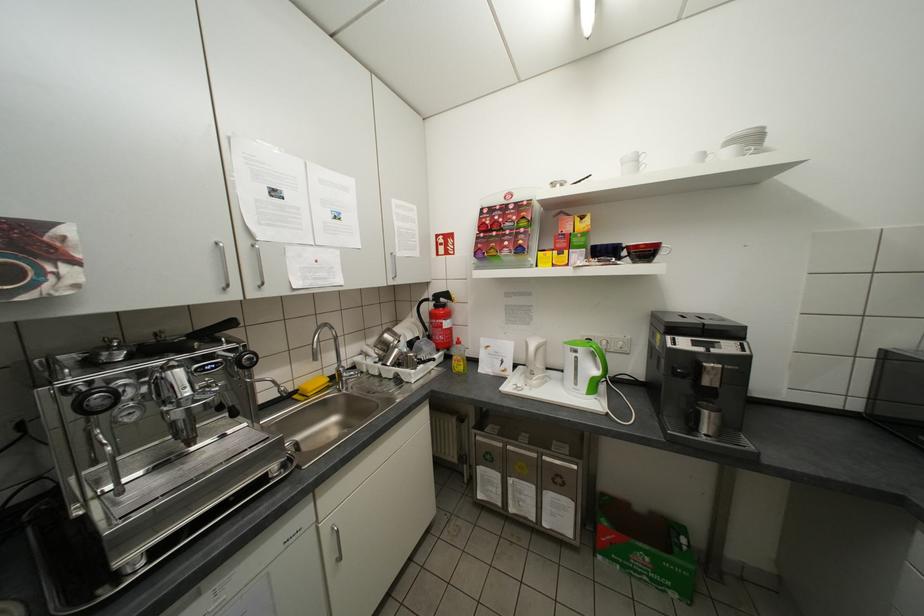
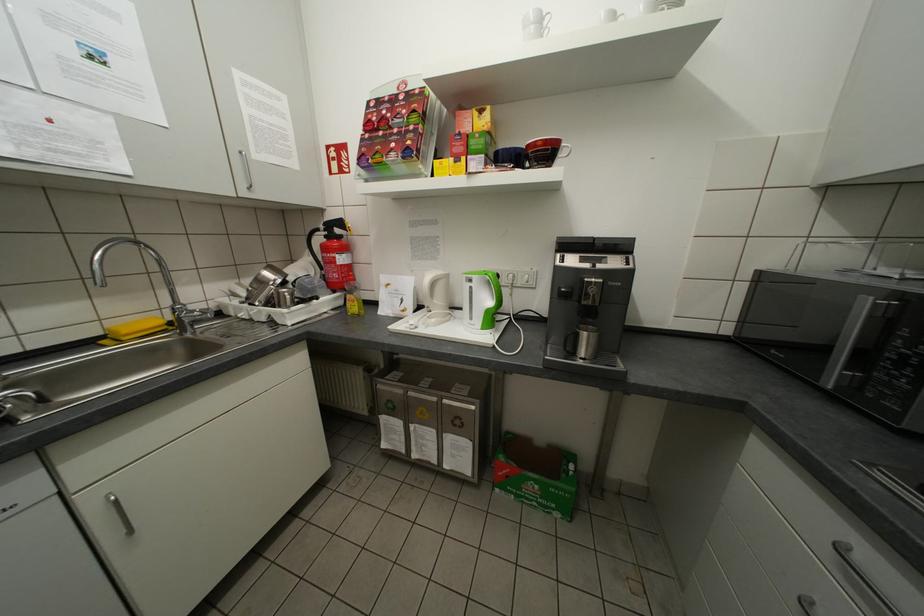
Locate, in the second image, the point that corresponds to point (436, 300) in the first image.

(325, 230)